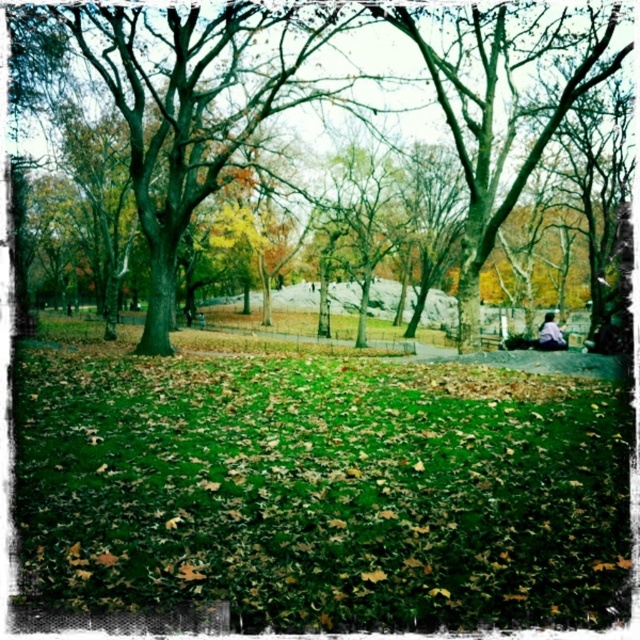
You are standing in the park and want to determine the relative positions of two points marked in the image. Which point is nearer to you, point 1 at coordinates (198,362) or point 2 at coordinates (205,125)?

Point 1 at coordinates (198,362) is closer to the viewer than point 2 at coordinates (205,125) according to the description.

Based on the photo, you are planning to set up a picnic blanket in the park. Given that the green grassy field at center is narrower than the green leafy tree at center, which area would you choose for your picnic to ensure there is enough space? Please explain your reasoning.

You should choose the green leafy tree at center because its width is greater than the green grassy field at center, providing more space for the picnic blanket.

You are planning to set up a picnic in the park. You have a picnic blanket that can cover an area of 2 square meters. Given the green grassy field at center and the green leafy tree at center, which area would be suitable for placing the blanket without overlapping with the tree?

The green grassy field at center has a smaller size compared to the green leafy tree at center. Since the picnic blanket requires 2 square meters, the green grassy field at center might be too small to accommodate the blanket without overlapping with the tree. Consider choosing an area away from the tree or a larger open space.